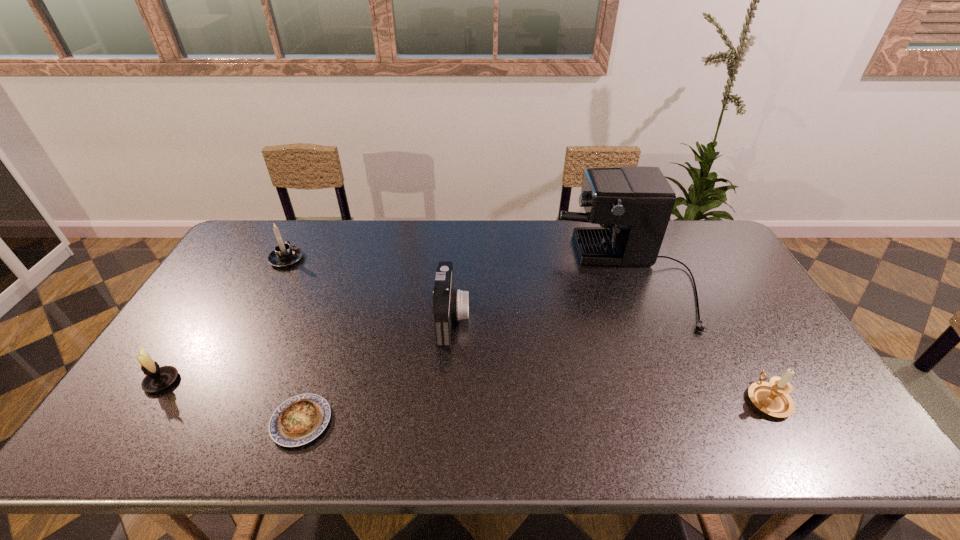
Locate an element on the screen. The height and width of the screenshot is (540, 960). free spot that satisfies the following two spatial constraints: 1. on the lens of the fourth object from left to right; 2. with a handle on the side of the rightmost candle holder is located at coordinates (446, 399).

At what (x,y) coordinates should I click in order to perform the action: click on vacant space that satisfies the following two spatial constraints: 1. on the front-facing side of the tallest object; 2. with a handle on the side of the rightmost candle holder. Please return your answer as a coordinate pair (x, y). The image size is (960, 540). Looking at the image, I should click on (674, 399).